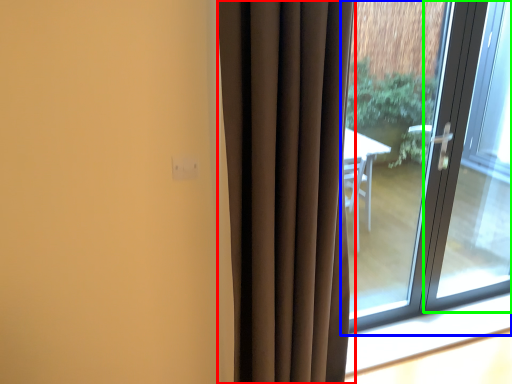
Question: Which object is the closest to the curtain (highlighted by a red box)? Choose among these: window (highlighted by a blue box) or screen door (highlighted by a green box).

Choices:
 (A) window
 (B) screen door

Answer: (A)